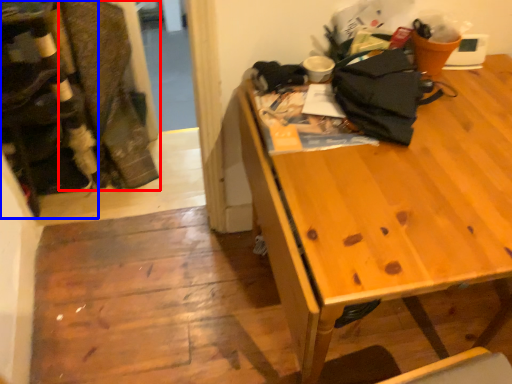
Question: Which object is further to the camera taking this photo, laundry (highlighted by a red box) or leftover (highlighted by a blue box)?

Choices:
 (A) laundry
 (B) leftover

Answer: (A)